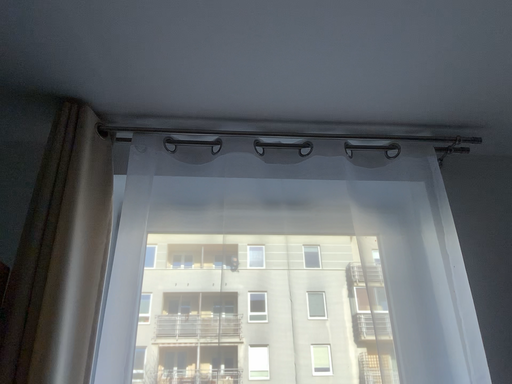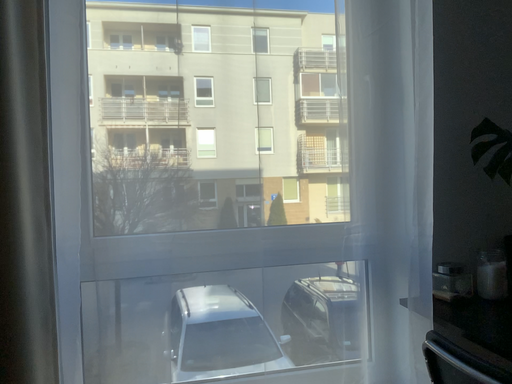
Question: Which way did the camera rotate in the video?

Choices:
 (A) rotated left
 (B) rotated right

Answer: (B)